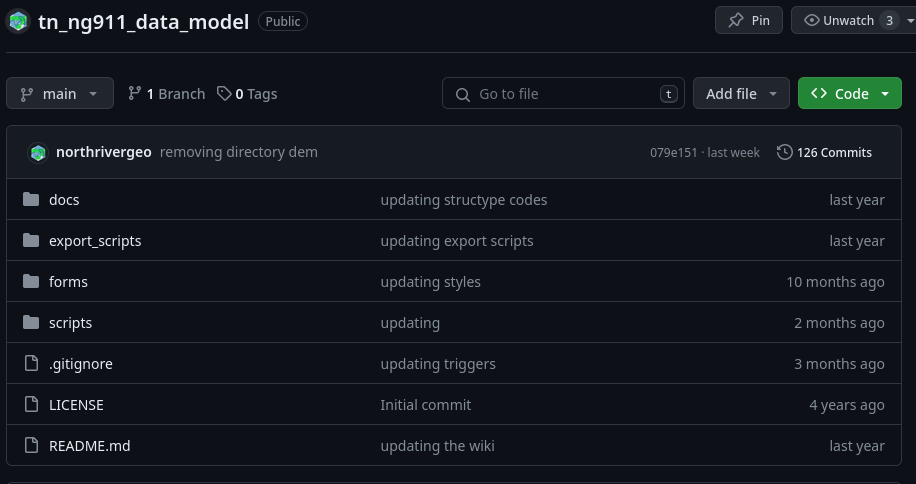
In order to click on folders in this screenshot , I will do `click(83, 315)`, `click(73, 284)`, `click(78, 250)`, `click(69, 210)`.